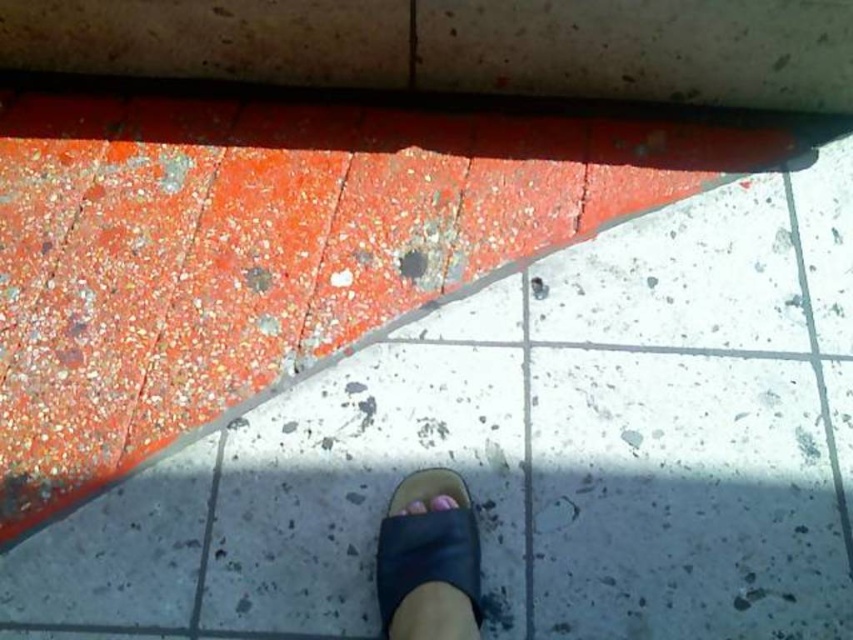
Question: Does black leather sandal at lower center appear over purple matte toe at center?

Choices:
 (A) no
 (B) yes

Answer: (A)

Question: Which of the following is the closest to the observer?

Choices:
 (A) (450, 506)
 (B) (381, 618)

Answer: (B)

Question: Which is nearer to the pink matte toe at center?

Choices:
 (A) purple matte toe at center
 (B) black leather sandal at lower center

Answer: (A)

Question: Can you confirm if purple matte toe at center is thinner than pink matte toe at center?

Choices:
 (A) yes
 (B) no

Answer: (A)

Question: In this image, where is black leather sandal at lower center located relative to pink matte toe at center?

Choices:
 (A) left
 (B) right

Answer: (B)

Question: Which of the following is the farthest from the observer?

Choices:
 (A) (451, 506)
 (B) (390, 628)

Answer: (A)